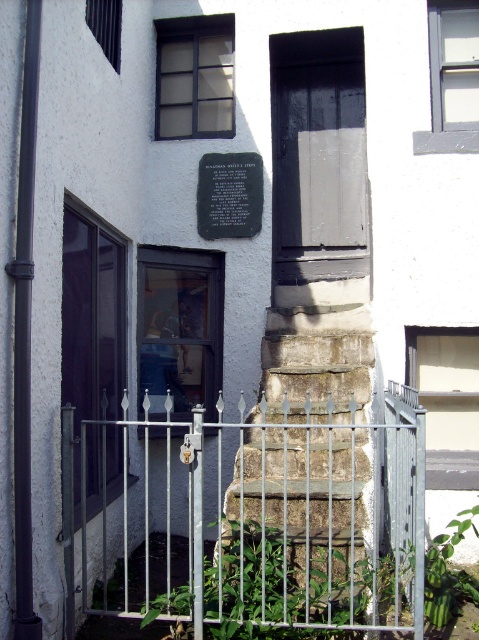
You are standing in front of the building and want to locate two specific points marked on the stone structure. The first point is at coordinate point (353, 90) and the second is at point (200, 304). Which point is closer to you?

Point (353, 90) is further to the viewer than point (200, 304), so the second point at (200, 304) is closer to you.

You are standing in front of the building and want to enter through the door. Based on the coordinates provided, where exactly is the matte black door at center located?

The matte black door at center is located at point coordinates of (319,156).